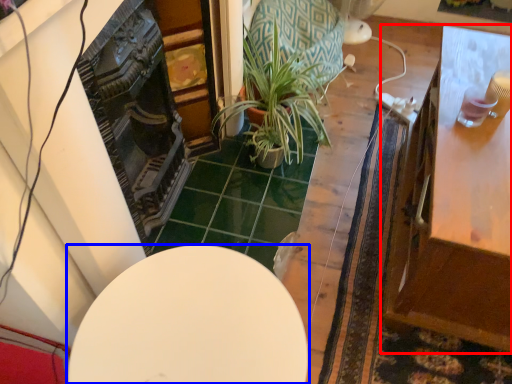
Question: Which object is closer to the camera taking this photo, table (highlighted by a red box) or table (highlighted by a blue box)?

Choices:
 (A) table
 (B) table

Answer: (B)